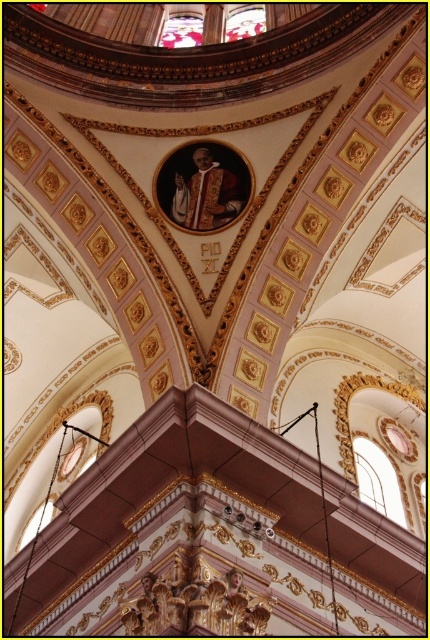
Question: Is clear glass window at upper center further to camera compared to transparent glass window at upper center?

Choices:
 (A) yes
 (B) no

Answer: (B)

Question: Which point is farther to the camera?

Choices:
 (A) transparent glass window at upper center
 (B) clear glass window at upper center

Answer: (A)

Question: Which object appears farthest from the camera in this image?

Choices:
 (A) clear glass window at upper center
 (B) transparent glass window at upper center
 (C) transparent stained glass at upper center

Answer: (C)

Question: Can you confirm if clear glass window at upper center is positioned to the right of transparent glass window at upper center?

Choices:
 (A) yes
 (B) no

Answer: (A)

Question: Which of the following is the closest to the observer?

Choices:
 (A) transparent stained glass at upper center
 (B) transparent glass window at upper center
 (C) clear glass window at upper center

Answer: (C)

Question: Is transparent glass window at upper center to the right of transparent stained glass at upper center from the viewer's perspective?

Choices:
 (A) no
 (B) yes

Answer: (A)